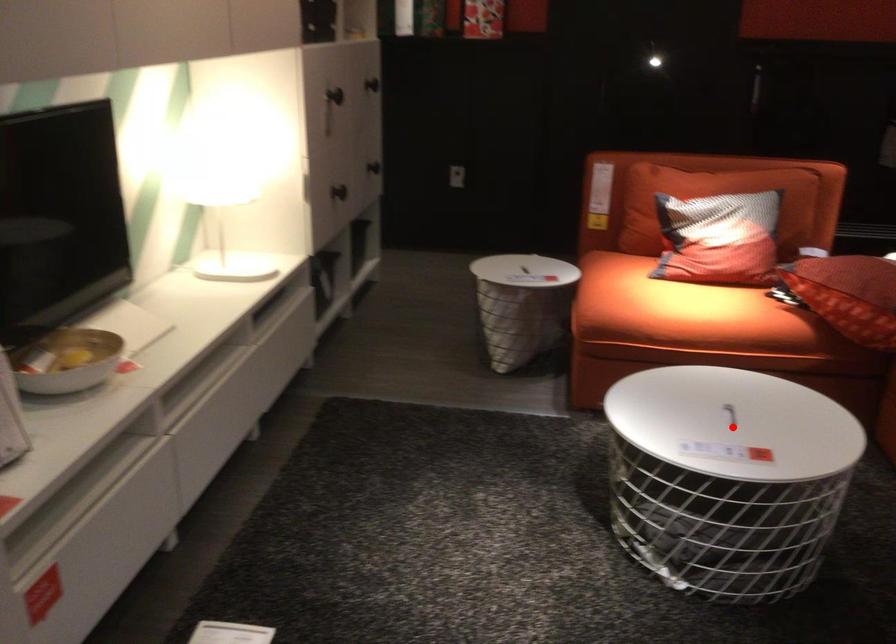
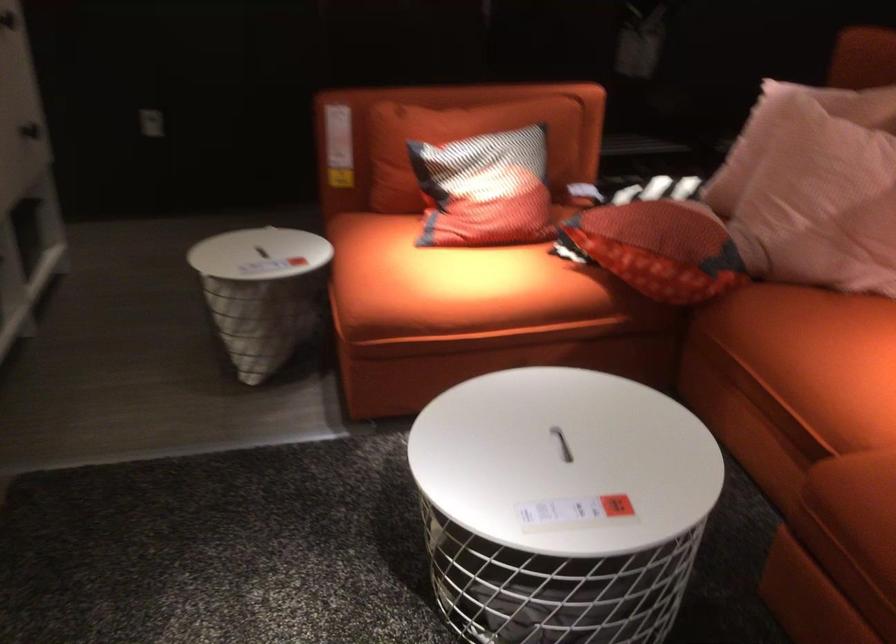
Question: I am providing you with two images of the same scene from different viewpoints. A red point is shown in image1. For the corresponding object point in image2, is it positioned nearer or farther from the camera?

Choices:
 (A) Nearer
 (B) Farther

Answer: (A)